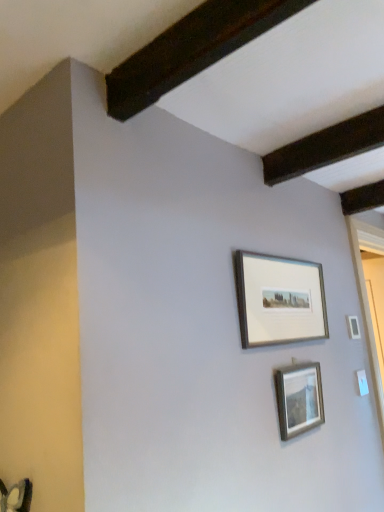
In order to click on silver metallic picture frame at upper center, the first picture frame when ordered from top to bottom in this screenshot , I will do `click(279, 300)`.

Image resolution: width=384 pixels, height=512 pixels. What do you see at coordinates (279, 300) in the screenshot? I see `silver metallic picture frame at upper center, the second picture frame from the bottom` at bounding box center [279, 300].

How much space does silver metallic picture frame at center, which appears as the 1th picture frame when ordered from the bottom, occupy horizontally?

The width of silver metallic picture frame at center, which appears as the 1th picture frame when ordered from the bottom, is 3.67 centimeters.

Describe the element at coordinates (299, 399) in the screenshot. I see `silver metallic picture frame at center, acting as the second picture frame starting from the top` at that location.

The width and height of the screenshot is (384, 512). What are the coordinates of `silver metallic picture frame at center, acting as the second picture frame starting from the top` in the screenshot? It's located at 299,399.

Locate an element on the screen. This screenshot has height=512, width=384. silver metallic picture frame at upper center, the first picture frame when ordered from top to bottom is located at coordinates (279, 300).

Considering the relative positions of silver metallic picture frame at center, acting as the second picture frame starting from the top, and silver metallic picture frame at upper center, the first picture frame when ordered from top to bottom, in the image provided, is silver metallic picture frame at center, acting as the second picture frame starting from the top, to the left or to the right of silver metallic picture frame at upper center, the first picture frame when ordered from top to bottom,?

From the image, it's evident that silver metallic picture frame at center, acting as the second picture frame starting from the top, is to the right of silver metallic picture frame at upper center, the first picture frame when ordered from top to bottom.

Is silver metallic picture frame at center, which appears as the 1th picture frame when ordered from the bottom, further to camera compared to silver metallic picture frame at upper center, the second picture frame from the bottom?

Yes, silver metallic picture frame at center, which appears as the 1th picture frame when ordered from the bottom, is further from the viewer.

Between point (277, 387) and point (276, 279), which one is positioned in front?

The point (277, 387) is more forward.

From the image's perspective, is silver metallic picture frame at center, acting as the second picture frame starting from the top, above silver metallic picture frame at upper center, the first picture frame when ordered from top to bottom?

No.

From a real-world perspective, relative to silver metallic picture frame at upper center, the second picture frame from the bottom, is silver metallic picture frame at center, acting as the second picture frame starting from the top, vertically above or below?

silver metallic picture frame at center, acting as the second picture frame starting from the top, is situated lower than silver metallic picture frame at upper center, the second picture frame from the bottom, in the real world.

Is silver metallic picture frame at center, which appears as the 1th picture frame when ordered from the bottom, wider or thinner than silver metallic picture frame at upper center, the first picture frame when ordered from top to bottom?

In the image, silver metallic picture frame at center, which appears as the 1th picture frame when ordered from the bottom, appears to be more narrow than silver metallic picture frame at upper center, the first picture frame when ordered from top to bottom.

Considering the relative sizes of silver metallic picture frame at center, which appears as the 1th picture frame when ordered from the bottom, and silver metallic picture frame at upper center, the first picture frame when ordered from top to bottom, in the image provided, is silver metallic picture frame at center, which appears as the 1th picture frame when ordered from the bottom, taller than silver metallic picture frame at upper center, the first picture frame when ordered from top to bottom,?

In fact, silver metallic picture frame at center, which appears as the 1th picture frame when ordered from the bottom, may be shorter than silver metallic picture frame at upper center, the first picture frame when ordered from top to bottom.

Which of these two, silver metallic picture frame at center, which appears as the 1th picture frame when ordered from the bottom, or silver metallic picture frame at upper center, the first picture frame when ordered from top to bottom, is bigger?

With larger size is silver metallic picture frame at upper center, the first picture frame when ordered from top to bottom.

Choose the correct answer: Is silver metallic picture frame at center, which appears as the 1th picture frame when ordered from the bottom, inside silver metallic picture frame at upper center, the first picture frame when ordered from top to bottom, or outside it?

silver metallic picture frame at center, which appears as the 1th picture frame when ordered from the bottom, is located beyond the bounds of silver metallic picture frame at upper center, the first picture frame when ordered from top to bottom.

Would you say silver metallic picture frame at center, which appears as the 1th picture frame when ordered from the bottom, is a long distance from silver metallic picture frame at upper center, the second picture frame from the bottom?

Actually, silver metallic picture frame at center, which appears as the 1th picture frame when ordered from the bottom, and silver metallic picture frame at upper center, the second picture frame from the bottom, are a little close together.

Is silver metallic picture frame at center, acting as the second picture frame starting from the top, turned away from silver metallic picture frame at upper center, the second picture frame from the bottom?

No, silver metallic picture frame at center, acting as the second picture frame starting from the top, is not facing away from silver metallic picture frame at upper center, the second picture frame from the bottom.

Where is `picture frame below the silver metallic picture frame at upper center, the second picture frame from the bottom (from a real-world perspective)`? The width and height of the screenshot is (384, 512). picture frame below the silver metallic picture frame at upper center, the second picture frame from the bottom (from a real-world perspective) is located at coordinates (299, 399).

Between silver metallic picture frame at upper center, the second picture frame from the bottom, and silver metallic picture frame at center, which appears as the 1th picture frame when ordered from the bottom, which one appears on the right side from the viewer's perspective?

silver metallic picture frame at center, which appears as the 1th picture frame when ordered from the bottom, is more to the right.

Consider the image. Between silver metallic picture frame at upper center, the first picture frame when ordered from top to bottom, and silver metallic picture frame at center, which appears as the 1th picture frame when ordered from the bottom, which one is positioned in front?

Positioned in front is silver metallic picture frame at upper center, the first picture frame when ordered from top to bottom.

Is point (276, 282) closer or farther from the camera than point (298, 407)?

Point (276, 282) appears to be farther away from the viewer than point (298, 407).

From the image's perspective, is silver metallic picture frame at upper center, the second picture frame from the bottom, located above or below silver metallic picture frame at center, acting as the second picture frame starting from the top?

Based on their image positions, silver metallic picture frame at upper center, the second picture frame from the bottom, is located above silver metallic picture frame at center, acting as the second picture frame starting from the top.

From a real-world perspective, is silver metallic picture frame at upper center, the second picture frame from the bottom, on silver metallic picture frame at center, which appears as the 1th picture frame when ordered from the bottom?

Yes, from a real-world perspective, silver metallic picture frame at upper center, the second picture frame from the bottom, is above silver metallic picture frame at center, which appears as the 1th picture frame when ordered from the bottom.

Does silver metallic picture frame at upper center, the second picture frame from the bottom, have a greater width compared to silver metallic picture frame at center, acting as the second picture frame starting from the top?

Yes.

Is silver metallic picture frame at upper center, the first picture frame when ordered from top to bottom, taller or shorter than silver metallic picture frame at center, acting as the second picture frame starting from the top?

Considering their sizes, silver metallic picture frame at upper center, the first picture frame when ordered from top to bottom, has more height than silver metallic picture frame at center, acting as the second picture frame starting from the top.

Which of these two, silver metallic picture frame at upper center, the second picture frame from the bottom, or silver metallic picture frame at center, which appears as the 1th picture frame when ordered from the bottom, is bigger?

Bigger between the two is silver metallic picture frame at upper center, the second picture frame from the bottom.

Looking at this image, would you say silver metallic picture frame at upper center, the first picture frame when ordered from top to bottom, is outside silver metallic picture frame at center, acting as the second picture frame starting from the top?

Yes, silver metallic picture frame at upper center, the first picture frame when ordered from top to bottom, is outside of silver metallic picture frame at center, acting as the second picture frame starting from the top.

From the picture: Is silver metallic picture frame at upper center, the second picture frame from the bottom, in contact with silver metallic picture frame at center, acting as the second picture frame starting from the top?

No, silver metallic picture frame at upper center, the second picture frame from the bottom, is not making contact with silver metallic picture frame at center, acting as the second picture frame starting from the top.

Based on the photo, is silver metallic picture frame at upper center, the first picture frame when ordered from top to bottom, looking in the opposite direction of silver metallic picture frame at center, acting as the second picture frame starting from the top?

silver metallic picture frame at upper center, the first picture frame when ordered from top to bottom, is not turned away from silver metallic picture frame at center, acting as the second picture frame starting from the top.

How many degrees apart are the facing directions of silver metallic picture frame at upper center, the second picture frame from the bottom, and silver metallic picture frame at center, which appears as the 1th picture frame when ordered from the bottom?

There is a 0.00254-degree angle between the facing directions of silver metallic picture frame at upper center, the second picture frame from the bottom, and silver metallic picture frame at center, which appears as the 1th picture frame when ordered from the bottom.

I want to click on picture frame that appears on the right of silver metallic picture frame at upper center, the first picture frame when ordered from top to bottom, so click(x=299, y=399).

I want to click on picture frame that appears on the left of silver metallic picture frame at center, acting as the second picture frame starting from the top, so click(x=279, y=300).

In the image, there is a silver metallic picture frame at upper center, the second picture frame from the bottom. Where is `picture frame below it (from the image's perspective)`? The width and height of the screenshot is (384, 512). picture frame below it (from the image's perspective) is located at coordinates (299, 399).